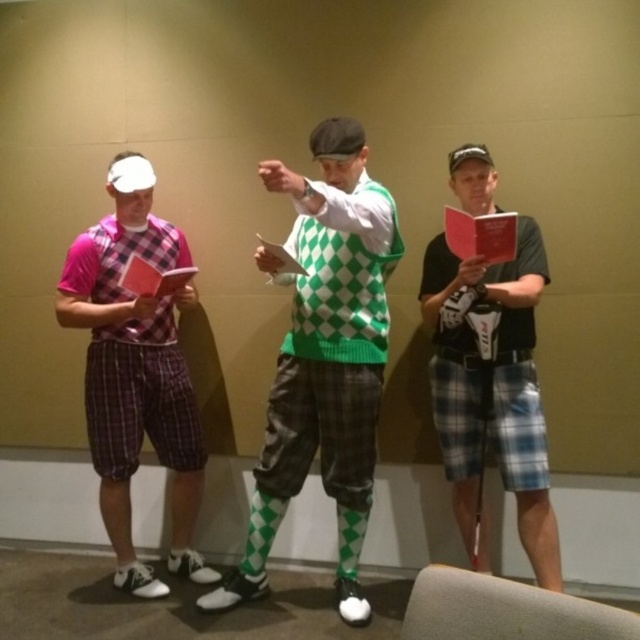
You are standing in front of the three people in the image. Based on their positions, which of the two points, point 1 at coordinates point (534, 301) or point 2 at coordinates point (502, 216), is closer to you?

Point 2 at coordinates point (502, 216) is closer to you because it is in front of point 1 at coordinates point (534, 301).

You are an event coordinator arranging a meeting. You need to hand out materials to the two people at the center. The gray plaid shorts at center and the red matte folder at center are both in the same location. Which object should you place the materials on to ensure they are visible and accessible?

The red matte folder at center is above the gray plaid shorts at center, so placing materials on the red matte folder at center would make them more visible and accessible.

You are organizing a meeting and need to choose between the matte red folder at left and the dark gray fabric baseball cap at center for a presentation prop. Based on their sizes, which object would be more visible to the audience?

The matte red folder at left is larger in size than the dark gray fabric baseball cap at center, so it would be more visible to the audience.